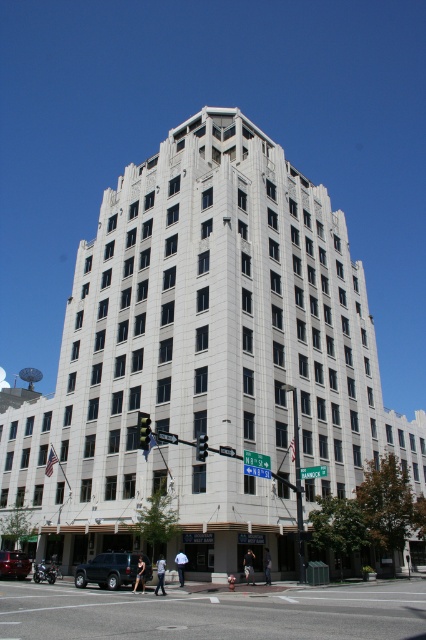
You are standing at the intersection in front of the Art Deco building and want to cross the asphalt road at lower center. The crosswalk is 60 feet away from your current position. Can you safely reach the crosswalk before the traffic light turns red in 10 seconds? Assume your walking speed is 3 feet per second.

The asphalt road at lower center is 62.10 feet away. Since the crosswalk is 60 feet away, you are still 2.10 feet away from the crosswalk. At a walking speed of 3 feet per second, it would take approximately 0.7 seconds to reach the crosswalk. With 10 seconds remaining before the light turns red, you have ample time to safely cross.

You are a delivery driver approaching the intersection in front of the Art Deco building. You need to make a left turn onto a road that is exactly at the coordinates provided in the scene description. Can you confirm if the asphalt road at lower center is positioned at the coordinates that would allow you to make this turn?

The asphalt road at lower center is positioned at coordinates point (213, 612), so yes, the asphalt road at lower center is at the correct coordinates to allow the left turn.